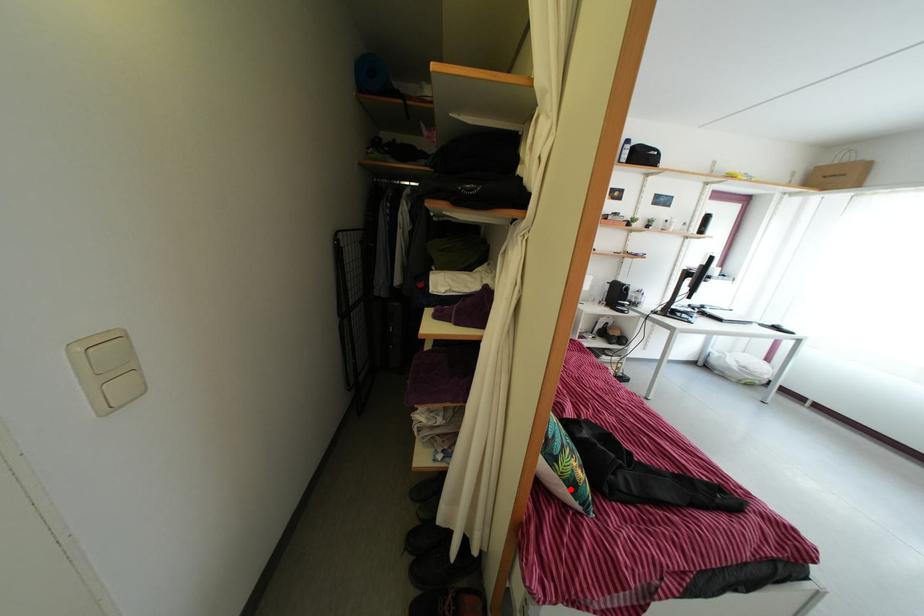
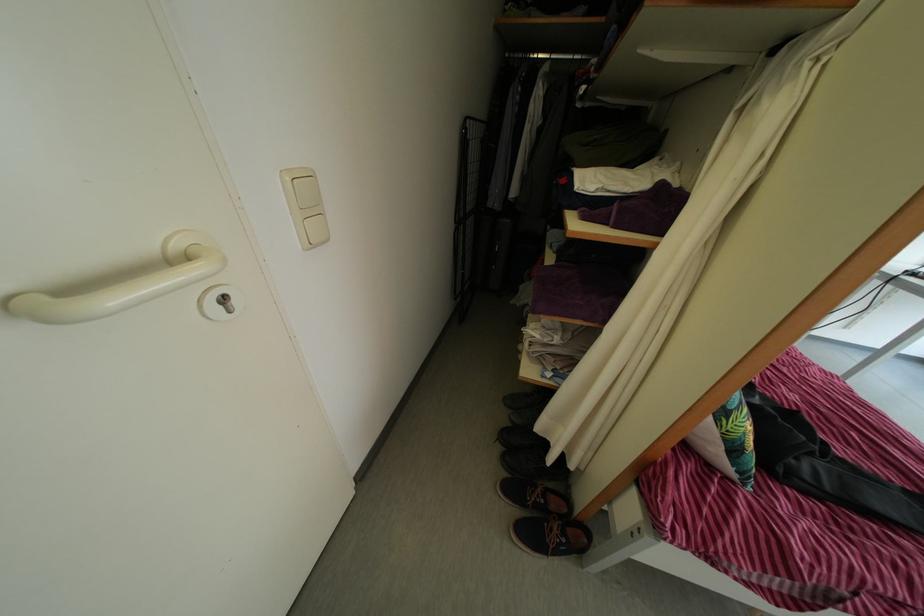
Locate, in the second image, the point that corresponds to the highlighted location in the first image.

(732, 448)